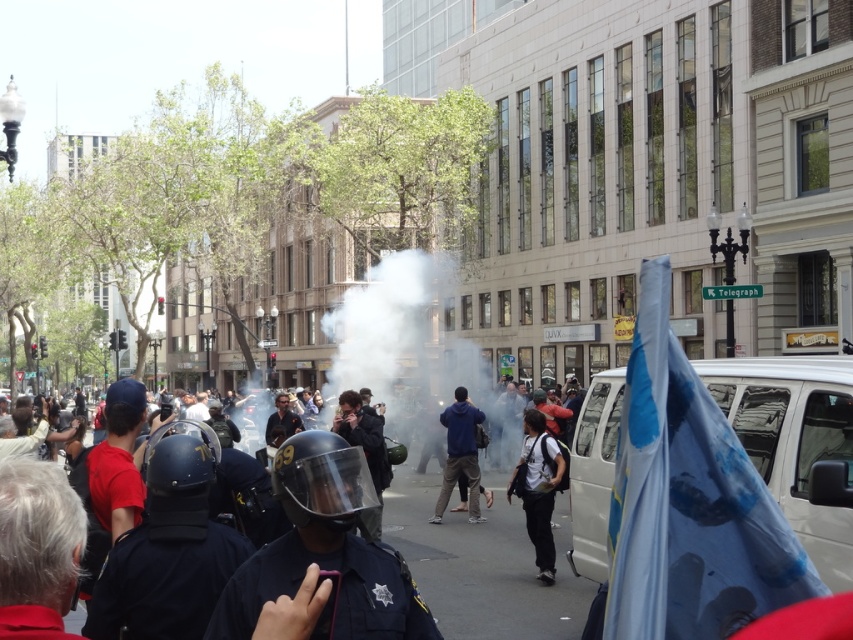
Who is more forward, (447,579) or (447,496)?

Positioned in front is point (447,579).

Between point (567, 524) and point (465, 460), which one is positioned behind?

Point (465, 460)

Where is `matte black helmet at center`? This screenshot has width=853, height=640. matte black helmet at center is located at coordinates (482, 564).

Who is positioned more to the right, white matte backpack at center or blue fleece jacket at center?

From the viewer's perspective, white matte backpack at center appears more on the right side.

Is point (532, 461) positioned after point (467, 404)?

That is False.

The height and width of the screenshot is (640, 853). In order to click on white matte backpack at center in this screenshot , I will do `click(538, 488)`.

What are the coordinates of `white matte backpack at center` in the screenshot? It's located at (538, 488).

Is shiny black helmet at center taller than white matte backpack at center?

No, shiny black helmet at center is not taller than white matte backpack at center.

Is the position of shiny black helmet at center more distant than that of white matte backpack at center?

That is False.

Is point (331, 438) farther from viewer compared to point (508, 486)?

No.

The height and width of the screenshot is (640, 853). In order to click on shiny black helmet at center in this screenshot , I will do `click(325, 552)`.